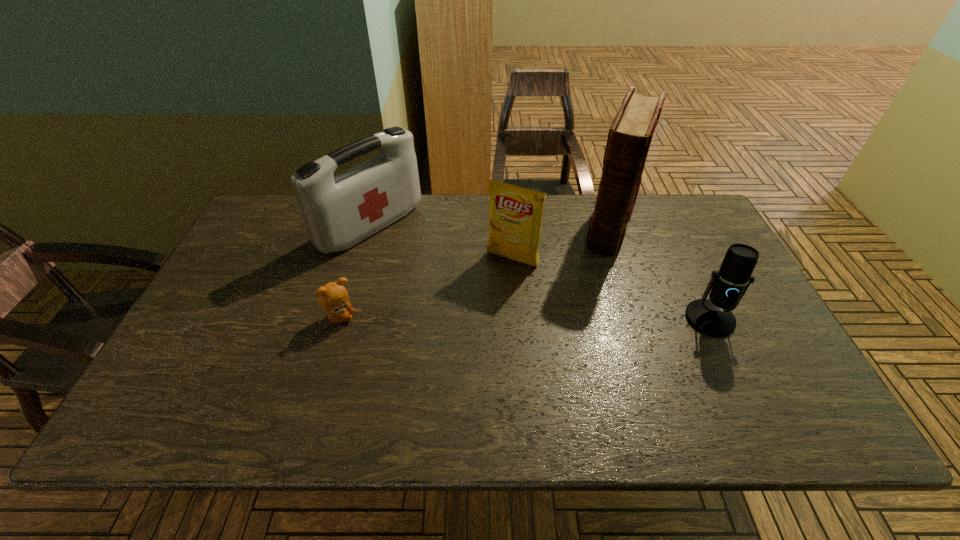
Identify the location of vacant area located 0.220m on the spine side of the second object from right to left. (589, 303).

You are a GUI agent. You are given a task and a screenshot of the screen. Output one action in this format:
    pyautogui.click(x=<x>, y=<y>)
    Task: Click on the vacant space located on the front of the third object from right to left with the logo
    The width and height of the screenshot is (960, 540).
    Given the screenshot: What is the action you would take?
    pyautogui.click(x=492, y=284)

At what (x,y) coordinates should I click in order to perform the action: click on vacant space located on the front of the third object from right to left with the logo. Please return your answer as a coordinate pair (x, y). Looking at the image, I should click on (492, 284).

Identify the location of free space located 0.180m on the front of the third object from right to left with the logo. (473, 314).

Where is `free spot located on the front side of the first-aid kit`? free spot located on the front side of the first-aid kit is located at coordinates (487, 308).

Where is `free space located 0.100m on the front side of the first-aid kit`? The width and height of the screenshot is (960, 540). free space located 0.100m on the front side of the first-aid kit is located at coordinates (424, 266).

At what (x,y) coordinates should I click in order to perform the action: click on vacant space situated 0.190m on the front side of the first-aid kit. Please return your answer as a coordinate pair (x, y). The height and width of the screenshot is (540, 960). Looking at the image, I should click on (446, 281).

Identify the location of hardback book present at the far edge. (630, 134).

Identify the location of the first-aid kit situated at the far edge. The width and height of the screenshot is (960, 540). (338, 212).

Where is `object present at the right edge`? object present at the right edge is located at coordinates (713, 317).